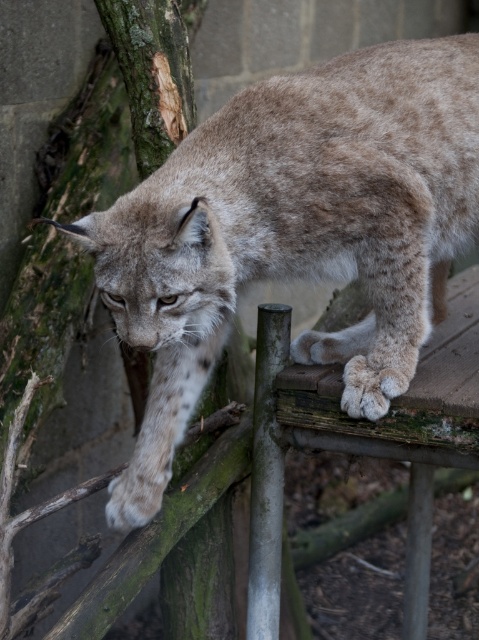
You are an animal caretaker observing a lynx in its enclosure. You notice the fuzzy brown fur at upper center and the green rough bark at left. Which object is wider in the image?

The fuzzy brown fur at upper center might be wider than green rough bark at left according to the description.

Based on the scene, which object is positioned lower in the image, the fuzzy brown fur at upper center or the green rough bark at left?

The fuzzy brown fur at upper center is located below the green rough bark at left, so the fuzzy brown fur at upper center is positioned lower in the image.